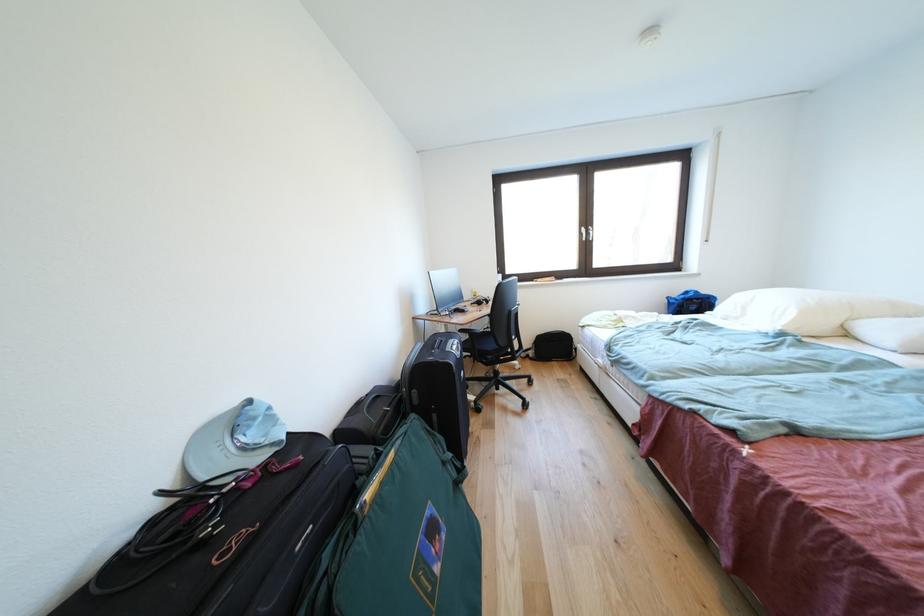
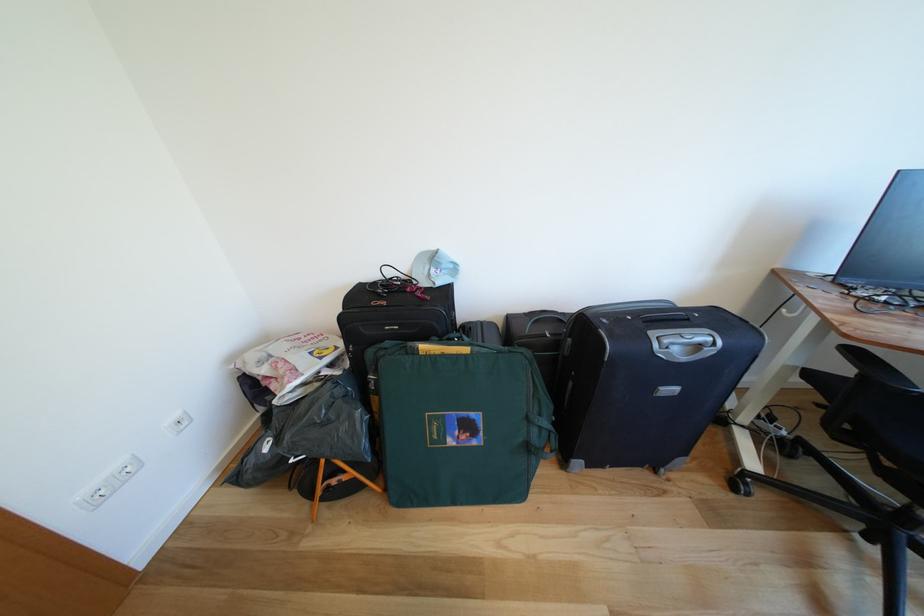
Locate, in the second image, the point that corresponds to pixel 466 351 in the first image.

(707, 351)